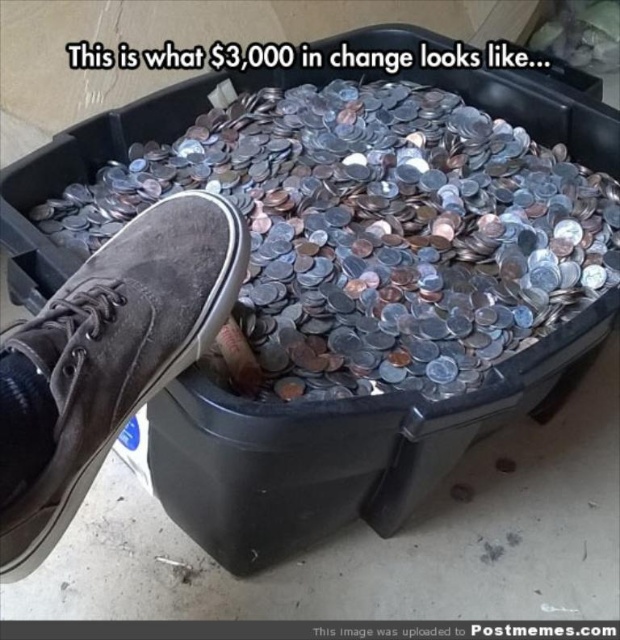
You are standing in front of the container with coins and want to place a new object on top of the coins. If you place it at the location of point (345, 129) or point (205, 264), which point is closer to the edge of the container?

Point (205, 264) is closer to the edge of the container because it is in front of point (345, 129), which is further back.

You are trying to retrieve the silver metallic coins at center from the container. The brown suede shoe at lower left is blocking your access. Can you move the shoe to get to the coins?

The brown suede shoe at lower left is behind the silver metallic coins at center, so moving the shoe would not block access to the coins. You can reach the coins without moving the shoe.

Where are the silver metallic coins at center located in the image?

The silver metallic coins at center are located at point (376,230).